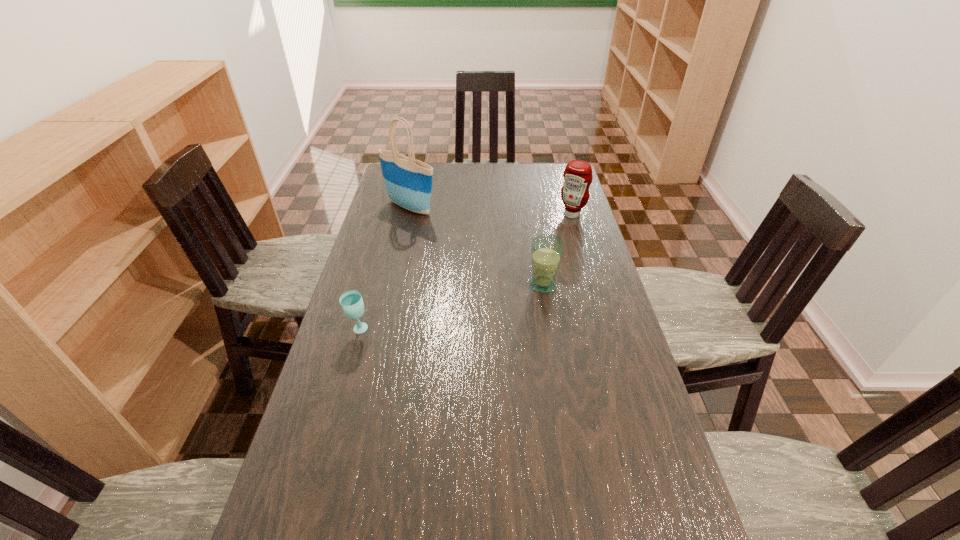
This screenshot has height=540, width=960. Find the location of `tote bag`. tote bag is located at coordinates (408, 182).

Locate an element on the screen. the rightmost object is located at coordinates (577, 175).

Image resolution: width=960 pixels, height=540 pixels. I want to click on condiment, so click(x=577, y=175).

Where is `the third object from left to right`? This screenshot has height=540, width=960. the third object from left to right is located at coordinates (546, 250).

Identify the location of the third tallest object. The height and width of the screenshot is (540, 960). (546, 250).

This screenshot has height=540, width=960. Find the location of `the shorter glass`. the shorter glass is located at coordinates (351, 301).

In order to click on the nearer glass in this screenshot , I will do `click(351, 301)`.

Identify the location of vacant area located 0.370m on the front of the tote bag. (394, 283).

You are a GUI agent. You are given a task and a screenshot of the screen. Output one action in this format:
    pyautogui.click(x=<x>, y=<y>)
    Task: Click on the vacant point located 0.060m on the left of the rightmost object
    
    Given the screenshot: What is the action you would take?
    pyautogui.click(x=543, y=214)

Locate an element on the screen. The height and width of the screenshot is (540, 960). free space located on the front of the taller glass is located at coordinates (553, 350).